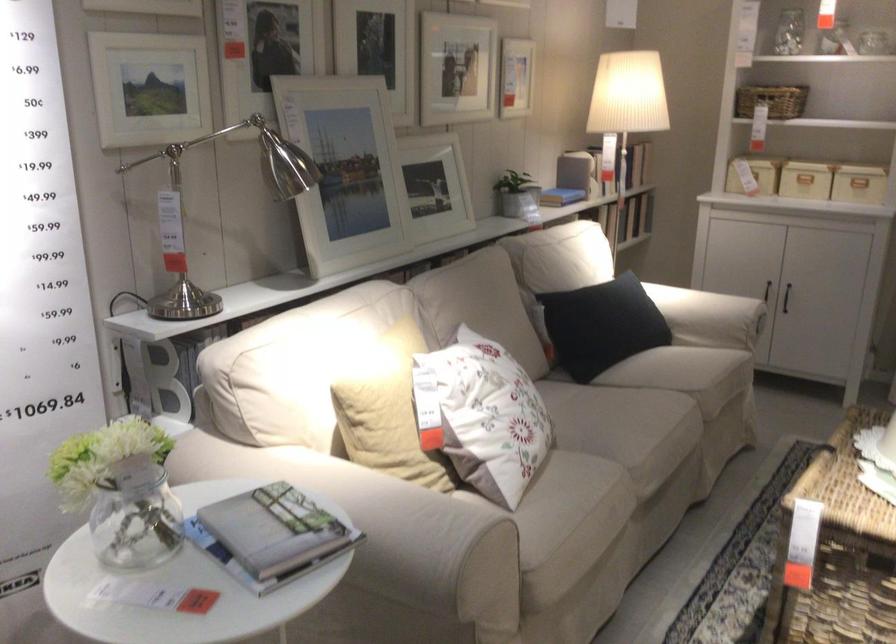
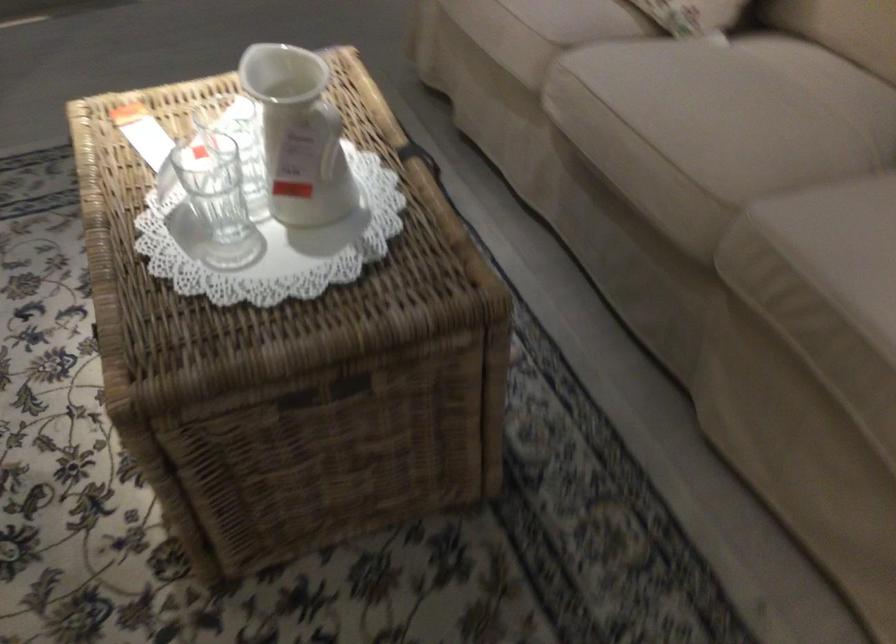
Locate, in the second image, the point that corresponds to (x=684, y=408) in the first image.

(704, 167)